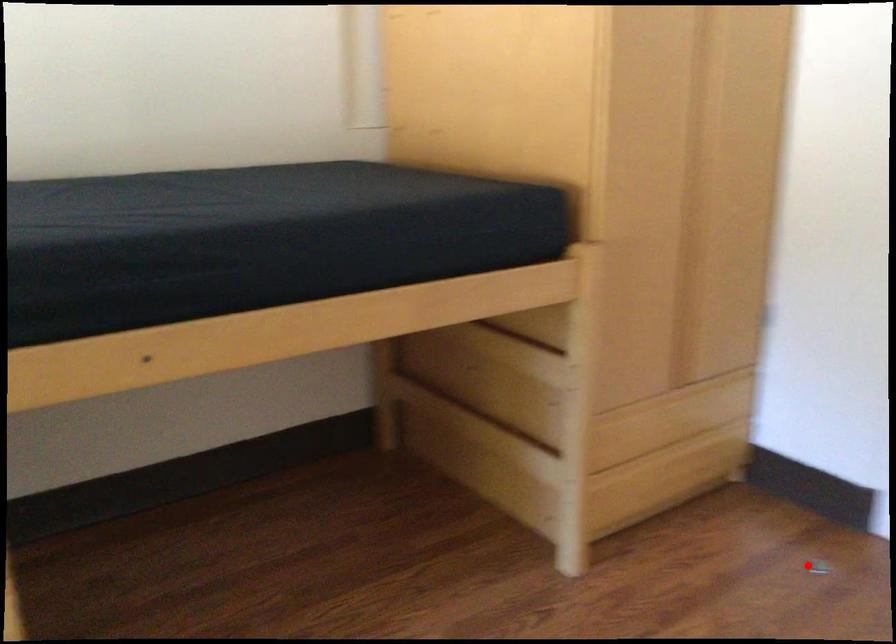
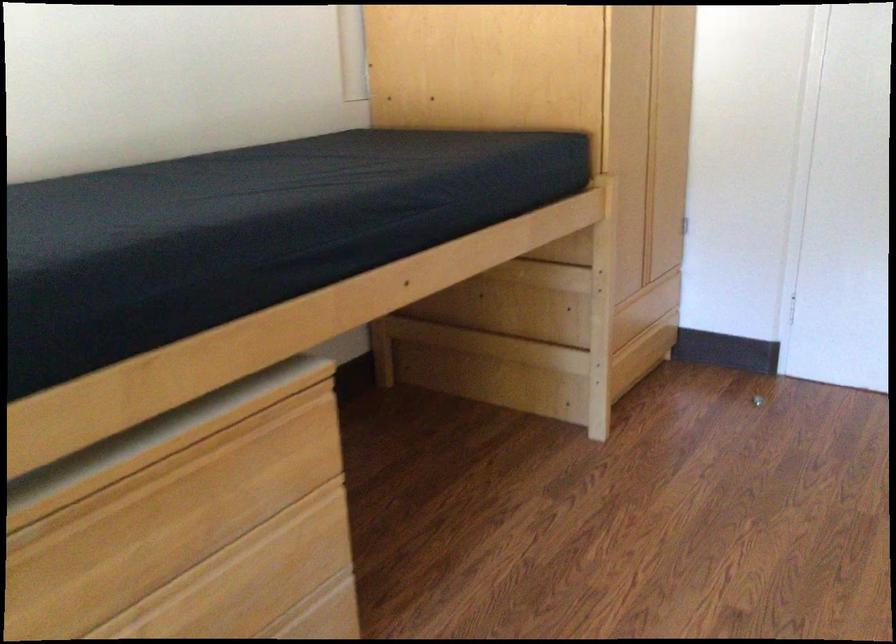
Question: A red point is marked in image1. In image2, is the corresponding 3D point closer to the camera or farther? Reply with the corresponding letter.

Choices:
 (A) The corresponding 3D point is closer.
 (B) The corresponding 3D point is farther.

Answer: (B)